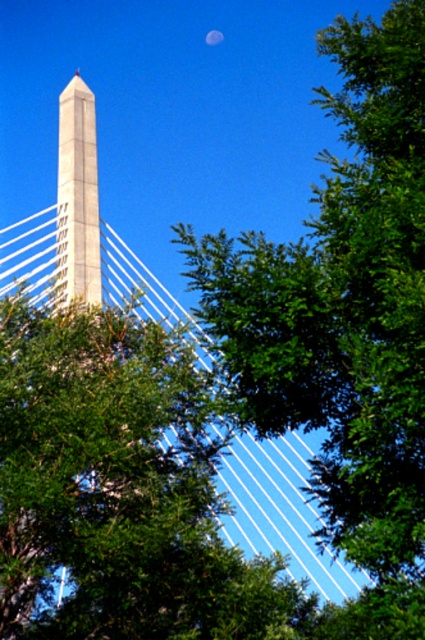
Question: In this image, where is green leafy tree at upper right located relative to white concrete obelisk at center?

Choices:
 (A) above
 (B) below

Answer: (B)

Question: Is green leafy tree at upper right to the right of white concrete obelisk at center from the viewer's perspective?

Choices:
 (A) yes
 (B) no

Answer: (A)

Question: Considering the relative positions of green leafy tree at upper right and white concrete obelisk at center in the image provided, where is green leafy tree at upper right located with respect to white concrete obelisk at center?

Choices:
 (A) left
 (B) right

Answer: (B)

Question: Which of the following is the closest to the observer?

Choices:
 (A) green leafy tree at upper right
 (B) white concrete obelisk at center

Answer: (A)

Question: Which point appears closest to the camera in this image?

Choices:
 (A) (371, 323)
 (B) (90, 301)

Answer: (A)